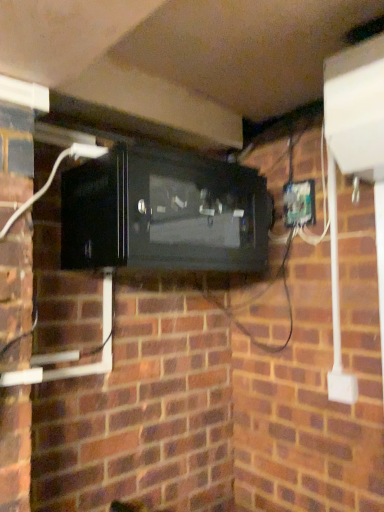
Question: Does green plastic electric outlet at right appear on the right side of black glossy microwave at center?

Choices:
 (A) no
 (B) yes

Answer: (B)

Question: From a real-world perspective, is green plastic electric outlet at right on black glossy microwave at center?

Choices:
 (A) no
 (B) yes

Answer: (B)

Question: Does green plastic electric outlet at right have a smaller size compared to black glossy microwave at center?

Choices:
 (A) yes
 (B) no

Answer: (A)

Question: Does green plastic electric outlet at right lie in front of black glossy microwave at center?

Choices:
 (A) yes
 (B) no

Answer: (B)

Question: Considering the relative sizes of green plastic electric outlet at right and black glossy microwave at center in the image provided, is green plastic electric outlet at right wider than black glossy microwave at center?

Choices:
 (A) no
 (B) yes

Answer: (A)

Question: Can you confirm if green plastic electric outlet at right is taller than black glossy microwave at center?

Choices:
 (A) no
 (B) yes

Answer: (A)

Question: Is black glossy microwave at center surrounding green plastic electric outlet at right?

Choices:
 (A) yes
 (B) no

Answer: (B)

Question: Can you confirm if black glossy microwave at center is taller than green plastic electric outlet at right?

Choices:
 (A) yes
 (B) no

Answer: (A)

Question: Can you confirm if black glossy microwave at center is positioned to the left of green plastic electric outlet at right?

Choices:
 (A) yes
 (B) no

Answer: (A)

Question: From the image's perspective, would you say black glossy microwave at center is shown under green plastic electric outlet at right?

Choices:
 (A) yes
 (B) no

Answer: (A)

Question: Would you say black glossy microwave at center is outside green plastic electric outlet at right?

Choices:
 (A) no
 (B) yes

Answer: (B)

Question: From the image's perspective, is black glossy microwave at center above green plastic electric outlet at right?

Choices:
 (A) no
 (B) yes

Answer: (A)

Question: From a real-world perspective, relative to black glossy microwave at center, is green plastic electric outlet at right vertically above or below?

Choices:
 (A) below
 (B) above

Answer: (B)